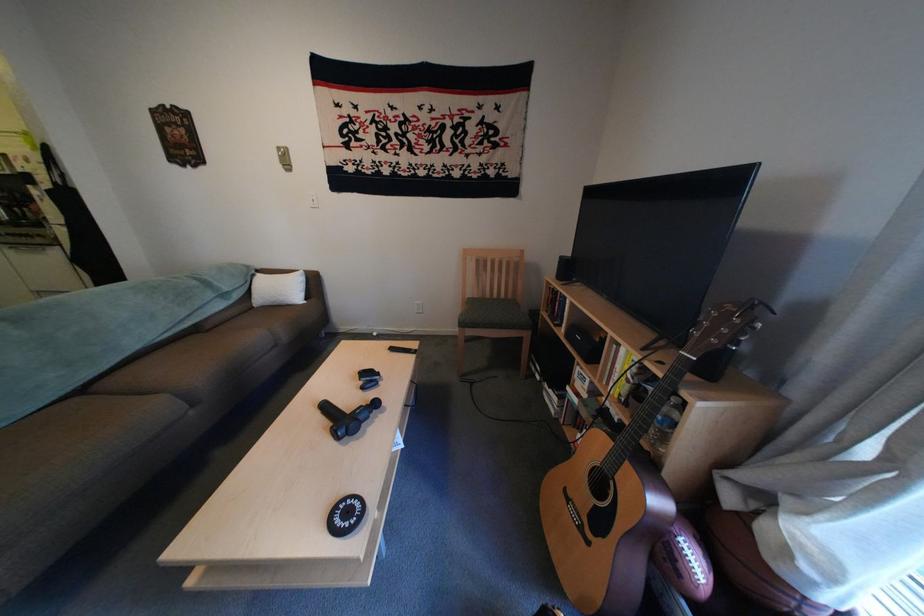
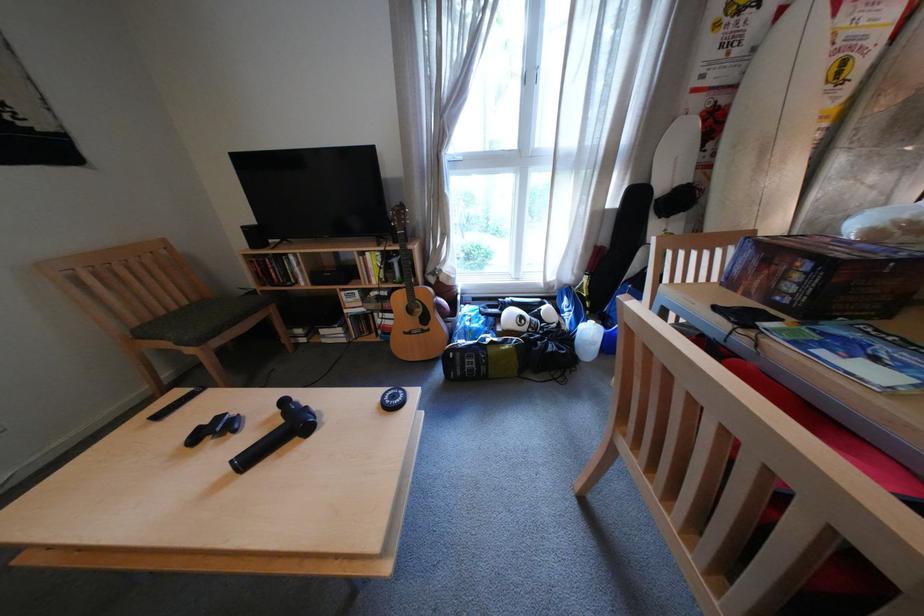
In the second image, find the point that corresponds to pixel 584 495 in the first image.

(420, 331)